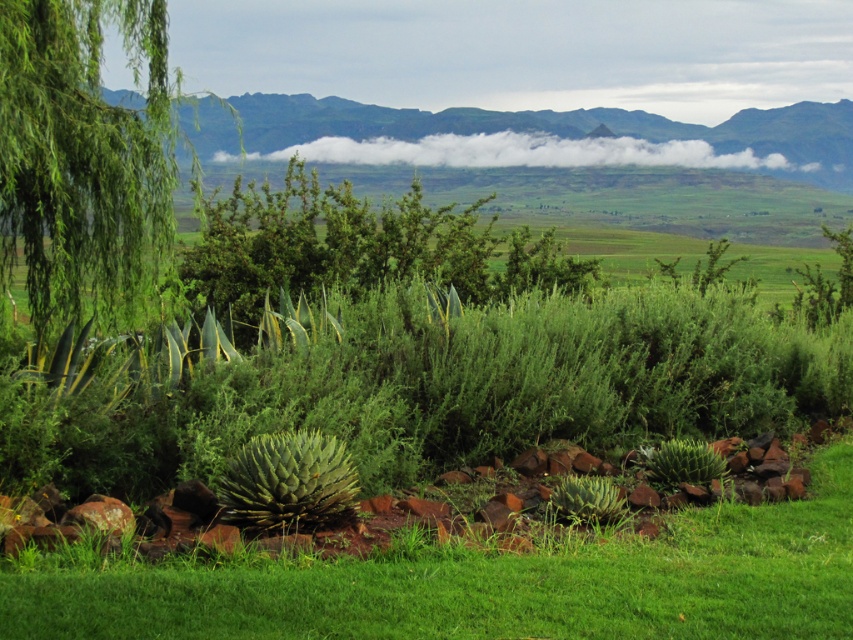
Question: Does green grassy at center appear under green leafy tree at left?

Choices:
 (A) no
 (B) yes

Answer: (B)

Question: Can you confirm if green leafy tree at left is bigger than green spiky plant at center?

Choices:
 (A) yes
 (B) no

Answer: (A)

Question: Based on their relative distances, which object is nearer to the green leafy tree at left?

Choices:
 (A) green grassy at center
 (B) green spiky plant at center

Answer: (B)

Question: Which object appears closest to the camera in this image?

Choices:
 (A) green grassy at center
 (B) green leafy tree at left
 (C) green spiky plant at center

Answer: (A)

Question: Which object is positioned farthest from the green spiky plant at center?

Choices:
 (A) green leafy tree at left
 (B) green grassy at center

Answer: (A)

Question: Does green grassy at center have a larger size compared to green spiky plant at center?

Choices:
 (A) no
 (B) yes

Answer: (B)